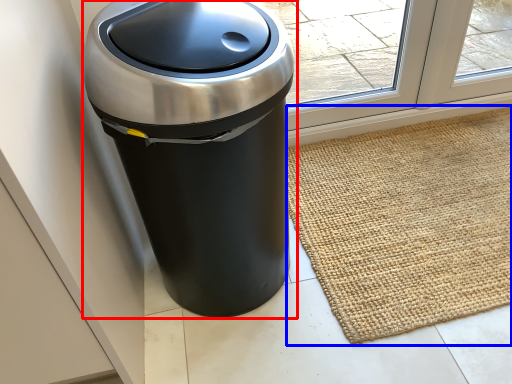
Question: Among these objects, which one is nearest to the camera, waste container (highlighted by a red box) or doormat (highlighted by a blue box)?

Choices:
 (A) waste container
 (B) doormat

Answer: (A)